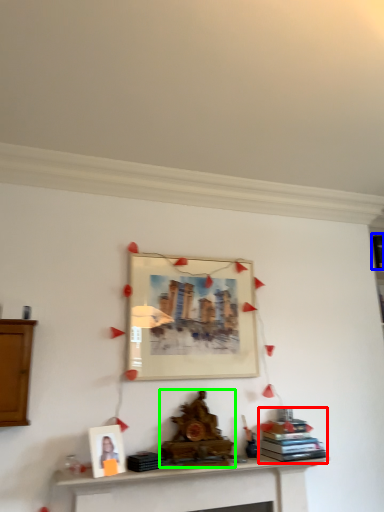
Question: Considering the real-world distances, which object is farthest from book (highlighted by a red box)? book (highlighted by a blue box) or fireplace (highlighted by a green box)?

Choices:
 (A) book
 (B) fireplace

Answer: (A)